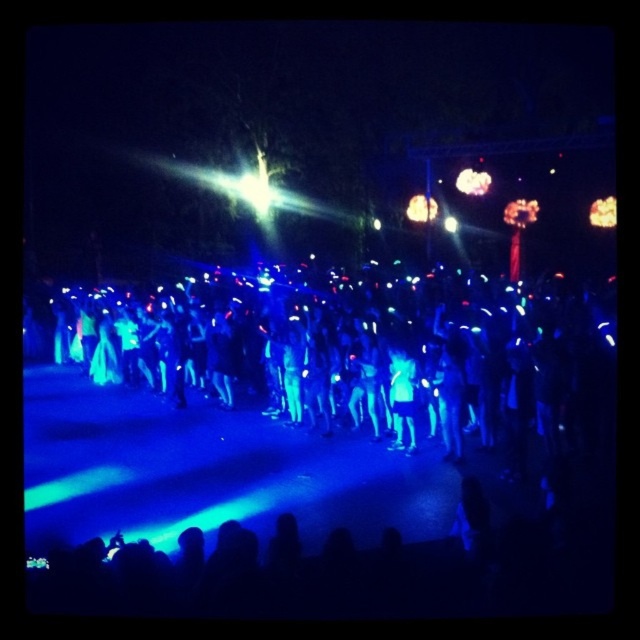
Question: Is blue glowing sticks at center positioned behind translucent amber light at upper right?

Choices:
 (A) no
 (B) yes

Answer: (A)

Question: Which of the following is the farthest from the observer?

Choices:
 (A) translucent amber light at upper right
 (B) matte white light at center

Answer: (B)

Question: Does blue glowing sticks at center appear on the left side of matte white light at center?

Choices:
 (A) yes
 (B) no

Answer: (A)

Question: From the image, what is the correct spatial relationship of blue glowing sticks at center in relation to matte white light at center?

Choices:
 (A) above
 (B) below

Answer: (B)

Question: Which is nearer to the translucent amber light at upper right?

Choices:
 (A) blue glowing sticks at center
 (B) matte white light at center

Answer: (B)

Question: Among these objects, which one is farthest from the camera?

Choices:
 (A) matte white light at center
 (B) translucent amber light at upper right
 (C) blue glowing sticks at center

Answer: (A)